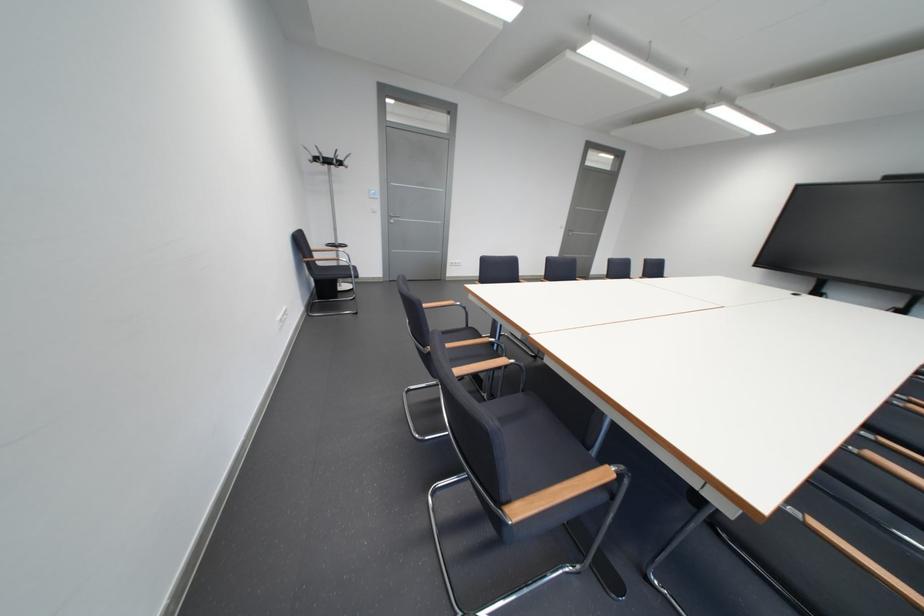
Find where to hang the coat rack hook. Please return your answer as a coordinate pair (x, y).

(326, 158)